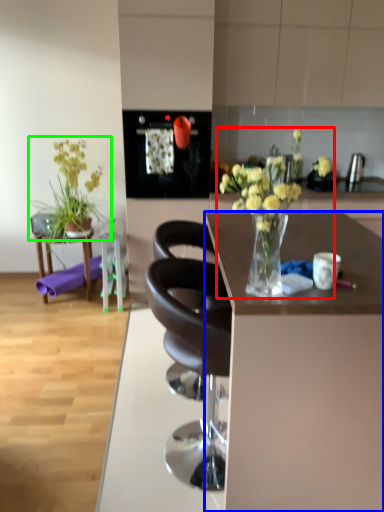
Question: Which object is the closest to the floral arrangement (highlighted by a red box)? Choose among these: desk (highlighted by a blue box) or houseplant (highlighted by a green box).

Choices:
 (A) desk
 (B) houseplant

Answer: (A)